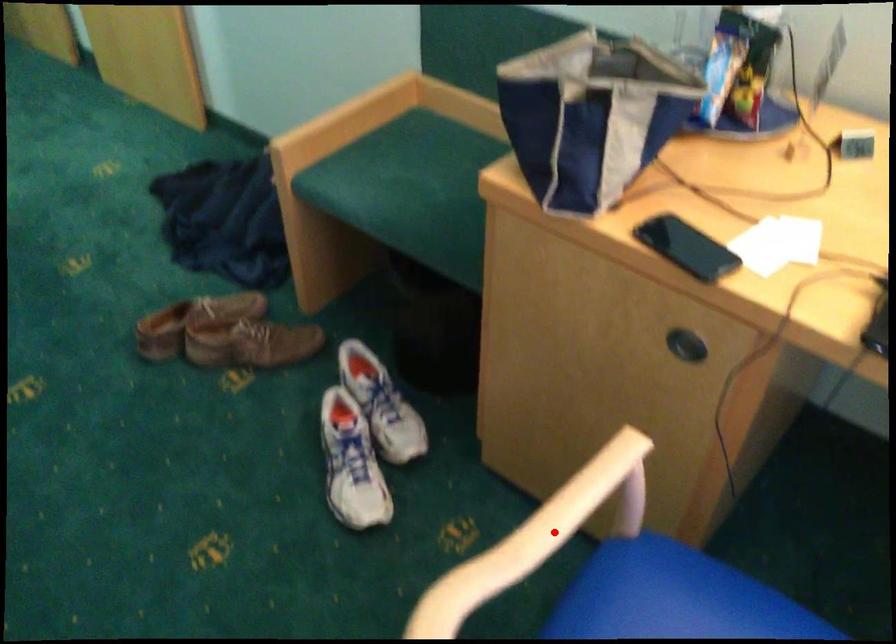
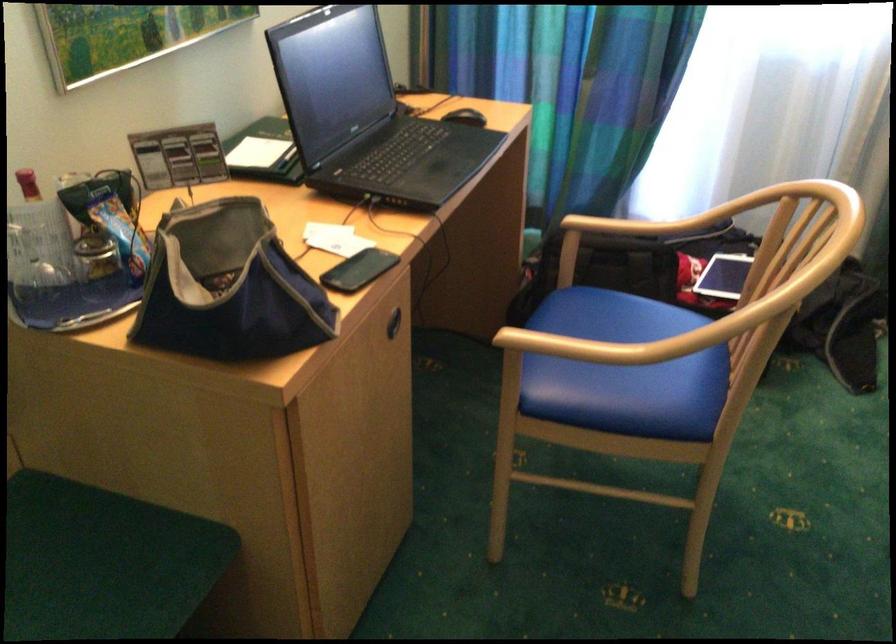
Locate, in the second image, the point that corresponds to the highlighted location in the first image.

(608, 346)